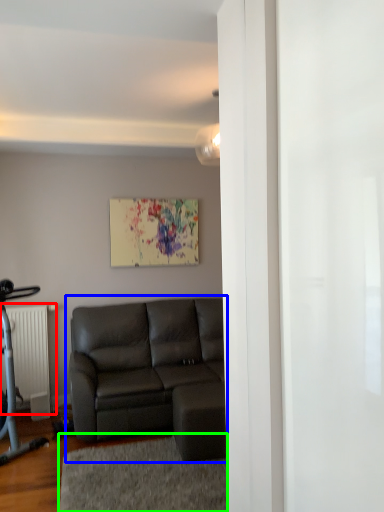
Question: Considering the real-world distances, which object is closest to radiator (highlighted by a red box)? studio couch (highlighted by a blue box) or yoga mat (highlighted by a green box).

Choices:
 (A) studio couch
 (B) yoga mat

Answer: (A)